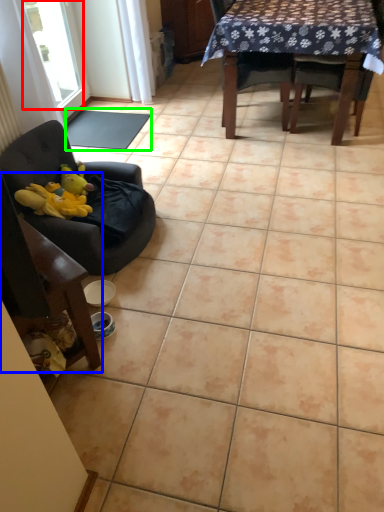
Question: Considering the real-world distances, which object is farthest from window (highlighted by a red box)? chair (highlighted by a blue box) or mat (highlighted by a green box)?

Choices:
 (A) chair
 (B) mat

Answer: (A)